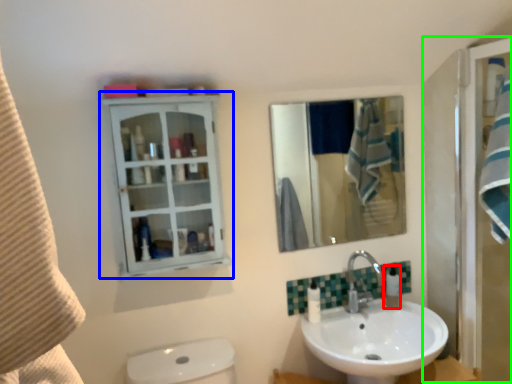
Question: Based on their relative distances, which object is farther from soap dispenser (highlighted by a red box)? Choose from bathroom cabinet (highlighted by a blue box) and screen door (highlighted by a green box).

Choices:
 (A) bathroom cabinet
 (B) screen door

Answer: (A)